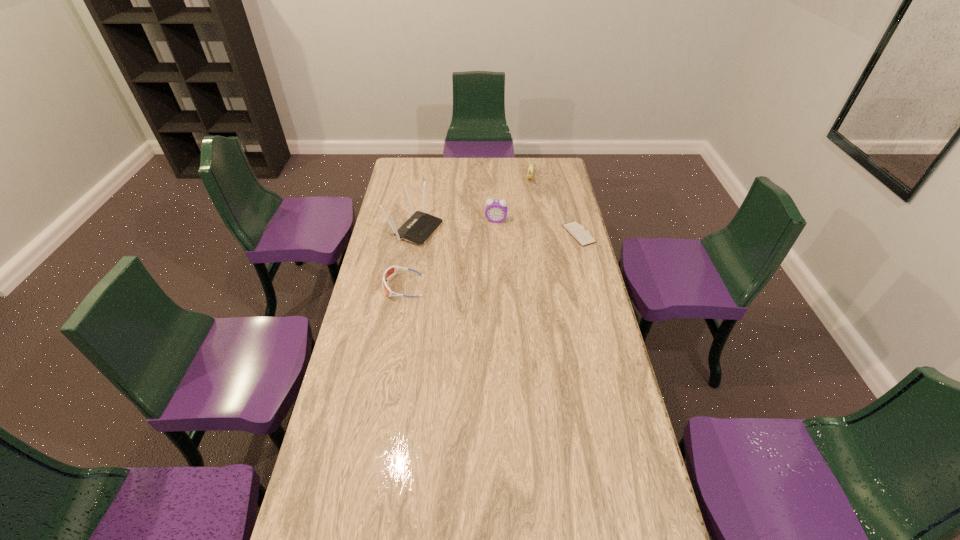
Identify the location of free space on the desktop that is between the fourth tallest object and the rightmost object and is positioned on the face of the alarm clock. (489, 261).

You are a GUI agent. You are given a task and a screenshot of the screen. Output one action in this format:
    pyautogui.click(x=<x>, y=<y>)
    Task: Click on the free space on the desktop that is between the nearest object and the shortest object and is positioned on the front-facing side of the tallest object
    The height and width of the screenshot is (540, 960).
    Given the screenshot: What is the action you would take?
    coord(504,256)

Image resolution: width=960 pixels, height=540 pixels. What are the coordinates of `free space on the desktop that is between the nearest object and the diary and is positioned at the stem of the third tallest object` in the screenshot? It's located at (519, 252).